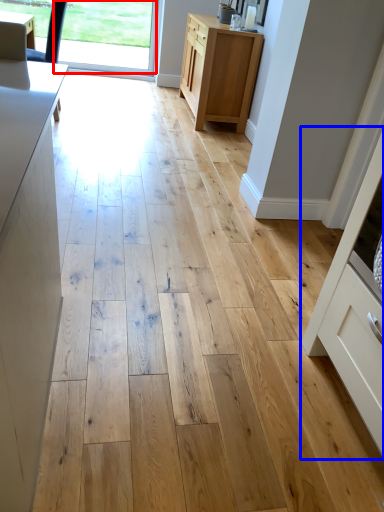
Question: Which point is closer to the camera, window screen (highlighted by a red box) or cabinetry (highlighted by a blue box)?

Choices:
 (A) window screen
 (B) cabinetry

Answer: (B)